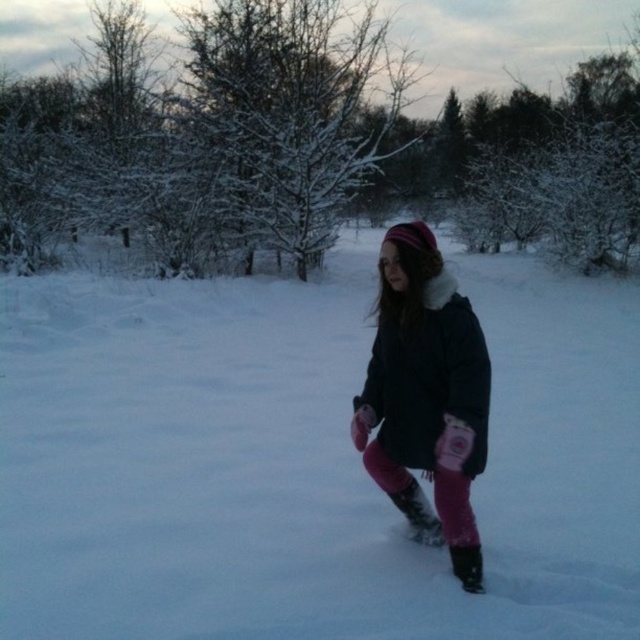
You are a drone operator trying to capture a photo of the girl walking in the snow. The camera is positioned at point 0.5, 0.5. Where should you move the camera to focus on the white fluffy snow at center?

The white fluffy snow at center is located at point (x=304, y=460), so you should move the camera to that coordinate to focus on it.

You are a photographer trying to capture the girl in the snow. You need to ensure that both the pink fleece pants at center and the matte black boot at center are in focus. Given that your camera has a depth of field that can cover 30 centimeters, will both objects be in focus?

The pink fleece pants at center is 32.50 centimeters from matte black boot at center. Since the distance between them exceeds the camera depth of field of 30 centimeters, both objects may not be in focus simultaneously.